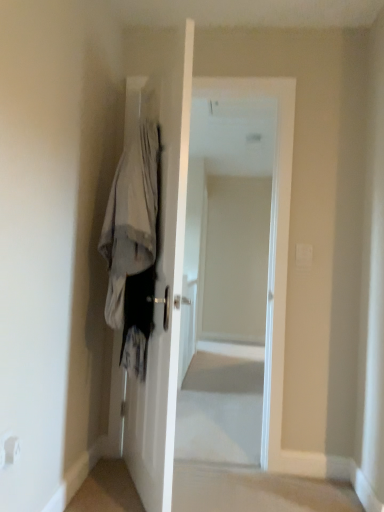
What do you see at coordinates (161, 253) in the screenshot?
I see `white glossy door at center` at bounding box center [161, 253].

You are a GUI agent. You are given a task and a screenshot of the screen. Output one action in this format:
    pyautogui.click(x=<x>, y=<y>)
    Task: Click on the white glossy door at center
    The width and height of the screenshot is (384, 512).
    Given the screenshot: What is the action you would take?
    pyautogui.click(x=233, y=290)

Image resolution: width=384 pixels, height=512 pixels. I want to click on white glossy door at center, so click(x=161, y=253).

Measure the distance from white fabric coat at left to white glossy door at center.

white fabric coat at left is 20.63 centimeters from white glossy door at center.

Is white fabric coat at left wider than white glossy door at center?

Yes.

Consider the image. Does white fabric coat at left turn towards white glossy door at center?

Yes, white fabric coat at left faces towards white glossy door at center.

Between white fabric coat at left and white glossy door at center, which one has more height?

Standing taller between the two is white glossy door at center.

Would you say white glossy door at center is to the left or to the right of white fabric coat at left in the picture?

white glossy door at center is to the right of white fabric coat at left.

In the scene shown: Is white glossy door at center positioned in front of white fabric coat at left?

No, white glossy door at center is further to the viewer.

From the picture: From the image's perspective, is white glossy door at center on white fabric coat at left?

No.

You are a GUI agent. You are given a task and a screenshot of the screen. Output one action in this format:
    pyautogui.click(x=<x>, y=<y>)
    Task: Click on the screen door beneath the white fabric coat at left (from a real-world perspective)
    Image resolution: width=384 pixels, height=512 pixels.
    Given the screenshot: What is the action you would take?
    pyautogui.click(x=233, y=290)

Which object is wider, white fabric coat at left or white glossy door at center?

With larger width is white fabric coat at left.

Is white fabric coat at left shorter than white glossy door at center?

Indeed, white fabric coat at left has a lesser height compared to white glossy door at center.

Which is behind, point (133, 206) or point (220, 362)?

Positioned behind is point (220, 362).

From a real-world perspective, which object stands above the other?

From a 3D spatial view, white fabric coat at left is above.

Is white glossy door at center facing towards white fabric coat at left?

Yes, white glossy door at center is facing white fabric coat at left.

Considering the sizes of objects white glossy door at center and white fabric coat at left in the image provided, who is taller, white glossy door at center or white fabric coat at left?

With more height is white glossy door at center.

Can you confirm if white glossy door at center is positioned to the left of white fabric coat at left?

Incorrect, white glossy door at center is not on the left side of white fabric coat at left.

Considering the relative positions of white glossy door at center and white glossy door at center in the image provided, is white glossy door at center to the left or to the right of white glossy door at center?

In the image, white glossy door at center appears on the left side of white glossy door at center.

How different are the orientations of white glossy door at center and white glossy door at center in degrees?

The angular difference between white glossy door at center and white glossy door at center is 113 degrees.

Is point (141, 440) farther from viewer compared to point (224, 158)?

No, (141, 440) is closer to viewer.

Can you see white glossy door at center touching white glossy door at center?

No, white glossy door at center is not with white glossy door at center.

Which object is positioned more to the left, white glossy door at center or white glossy door at center?

From the viewer's perspective, white glossy door at center appears more on the left side.

Would you say white glossy door at center is part of white glossy door at center's contents?

Actually, white glossy door at center is outside white glossy door at center.

Is white glossy door at center oriented away from white glossy door at center?

Absolutely, white glossy door at center is directed away from white glossy door at center.

From the picture: From the image's perspective, is white glossy door at center on top of white glossy door at center?

Yes, from the image's perspective, white glossy door at center is on top of white glossy door at center.

This screenshot has height=512, width=384. Identify the location of door located below the white fabric coat at left (from the image's perspective). (161, 253).

You are a GUI agent. You are given a task and a screenshot of the screen. Output one action in this format:
    pyautogui.click(x=<x>, y=<y>)
    Task: Click on the screen door behind the white fabric coat at left
    
    Given the screenshot: What is the action you would take?
    pyautogui.click(x=233, y=290)

Which object lies further to the anchor point white fabric coat at left, white glossy door at center or white glossy door at center?

Among the two, white glossy door at center is located further to white fabric coat at left.

Estimate the real-world distances between objects in this image. Which object is closer to white glossy door at center, white glossy door at center or white fabric coat at left?

white glossy door at center is positioned closer to the anchor white glossy door at center.

Looking at the image, which one is located further to white glossy door at center, white fabric coat at left or white glossy door at center?

white glossy door at center is positioned further to the anchor white glossy door at center.

Based on their spatial positions, is white glossy door at center or white fabric coat at left closer to white glossy door at center?

The object closer to white glossy door at center is white fabric coat at left.

Looking at this image, based on their spatial positions, is white fabric coat at left or white glossy door at center closer to white glossy door at center?

Among the two, white glossy door at center is located nearer to white glossy door at center.

Considering their positions, is white glossy door at center positioned further to white fabric coat at left than white glossy door at center?

white glossy door at center is further to white fabric coat at left.

Locate an element on the screen. The image size is (384, 512). clothing between white glossy door at center and white glossy door at center from front to back is located at coordinates (133, 245).